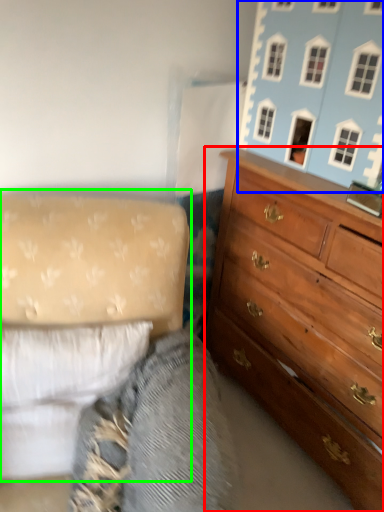
Question: Based on their relative distances, which object is nearer to chest of drawers (highlighted by a red box)? Choose from toy (highlighted by a blue box) and studio couch (highlighted by a green box).

Choices:
 (A) toy
 (B) studio couch

Answer: (A)